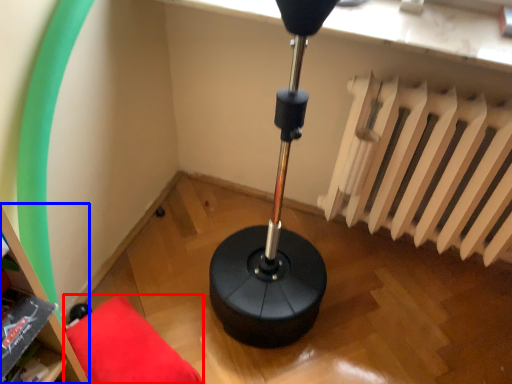
Question: Which object is further to the camera taking this photo, furniture (highlighted by a red box) or bookshelf (highlighted by a blue box)?

Choices:
 (A) furniture
 (B) bookshelf

Answer: (A)